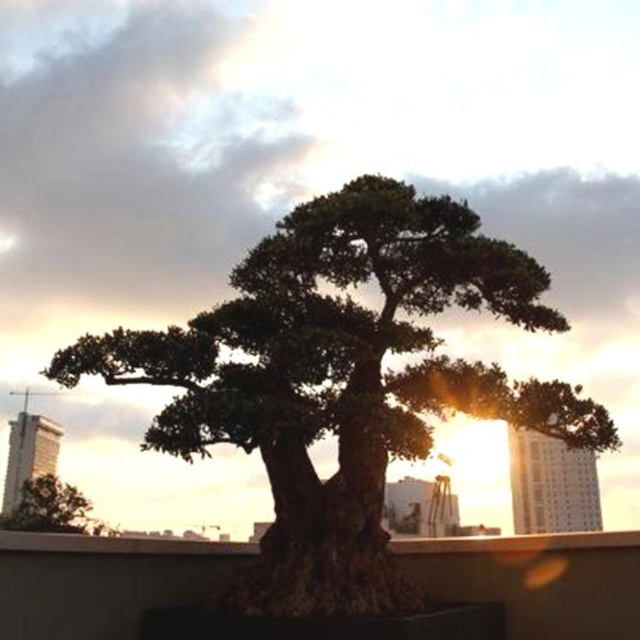
Who is more distant from viewer, (276, 397) or (20, 497)?

The point (20, 497) is more distant.

In the scene shown: Can you confirm if green textured tree at center is positioned below green leafy tree at lower left?

No, green textured tree at center is not below green leafy tree at lower left.

Between point (484, 410) and point (68, 518), which one is positioned in front?

Point (484, 410) is more forward.

Locate an element on the screen. The height and width of the screenshot is (640, 640). green textured tree at center is located at coordinates (340, 380).